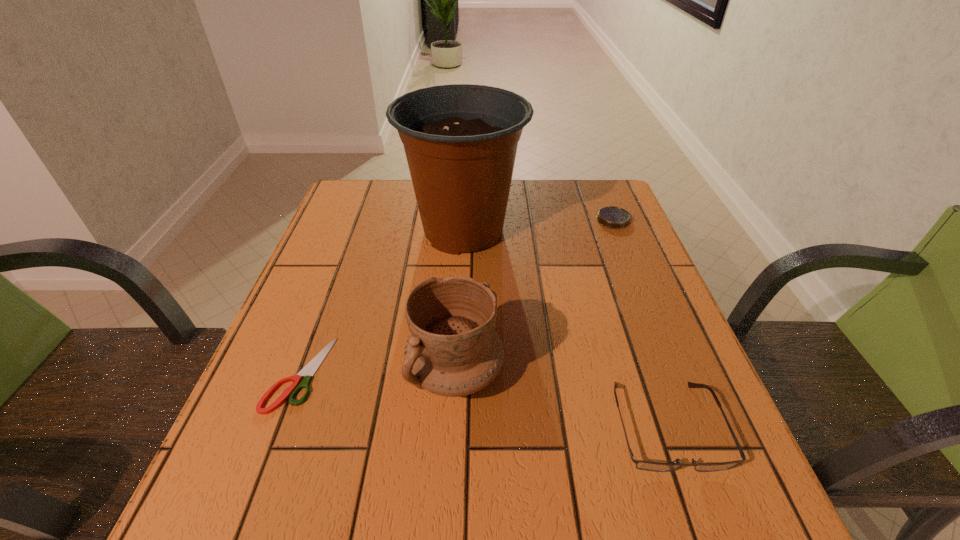
Locate an element on the screen. Image resolution: width=960 pixels, height=540 pixels. object that can be found as the closest to the pottery is located at coordinates (309, 370).

The height and width of the screenshot is (540, 960). I want to click on vacant area that satisfies the following two spatial constraints: 1. on the back side of the scissors; 2. on the right side of the second tallest object, so click(x=300, y=373).

Locate an element on the screen. The height and width of the screenshot is (540, 960). free spot that satisfies the following two spatial constraints: 1. on the back side of the compass; 2. on the left side of the tallest object is located at coordinates (464, 220).

The height and width of the screenshot is (540, 960). What are the coordinates of `vacant space that satisfies the following two spatial constraints: 1. on the back side of the pottery; 2. on the right side of the shortest object` in the screenshot? It's located at (300, 373).